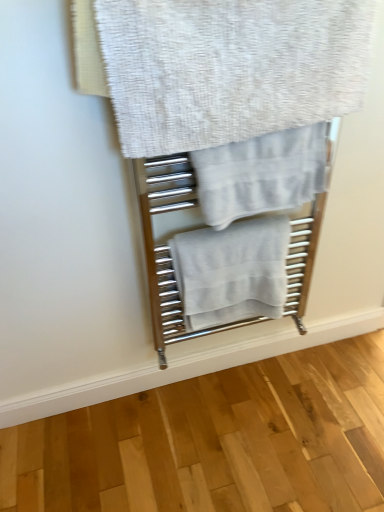
How much space does light gray cotton towel at center, which ranks as the second towel in top-to-bottom order, occupy horizontally?

The width of light gray cotton towel at center, which ranks as the second towel in top-to-bottom order, is 5.88 inches.

Image resolution: width=384 pixels, height=512 pixels. What are the coordinates of `white textured towel at upper center, marked as the third towel in a bottom-to-top arrangement` in the screenshot? It's located at (230, 68).

Is white cotton towel at center, the 3th towel in the top-to-bottom sequence, not inside white textured towel at upper center, acting as the first towel starting from the top?

Yes, white cotton towel at center, the 3th towel in the top-to-bottom sequence, is not within white textured towel at upper center, acting as the first towel starting from the top.

Is point (198, 245) positioned in front of point (298, 13)?

No, it is behind (298, 13).

Can you confirm if white cotton towel at center, the 3th towel in the top-to-bottom sequence, is bigger than white textured towel at upper center, marked as the third towel in a bottom-to-top arrangement?

No, white cotton towel at center, the 3th towel in the top-to-bottom sequence, is not bigger than white textured towel at upper center, marked as the third towel in a bottom-to-top arrangement.

Is white cotton towel at center, the 3th towel in the top-to-bottom sequence, in front of white textured towel at upper center, marked as the third towel in a bottom-to-top arrangement?

No, it is behind white textured towel at upper center, marked as the third towel in a bottom-to-top arrangement.

Can you tell me how much white cotton towel at center, which is the 1th towel in bottom-to-top order, and light gray cotton towel at center, which ranks as the second towel in top-to-bottom order, differ in facing direction?

0.000276 degrees separate the facing orientations of white cotton towel at center, which is the 1th towel in bottom-to-top order, and light gray cotton towel at center, which ranks as the second towel in top-to-bottom order.

Visually, is white cotton towel at center, the 3th towel in the top-to-bottom sequence, positioned to the left or to the right of light gray cotton towel at center, which ranks as the second towel in top-to-bottom order?

Clearly, white cotton towel at center, the 3th towel in the top-to-bottom sequence, is on the left of light gray cotton towel at center, which ranks as the second towel in top-to-bottom order, in the image.

Is white cotton towel at center, which is the 1th towel in bottom-to-top order, located outside light gray cotton towel at center, which is the second towel from bottom to top?

Yes, white cotton towel at center, which is the 1th towel in bottom-to-top order, is outside of light gray cotton towel at center, which is the second towel from bottom to top.

Considering the positions of points (188, 289) and (201, 196), is point (188, 289) farther from camera compared to point (201, 196)?

Yes.

Is white textured towel at upper center, marked as the third towel in a bottom-to-top arrangement, oriented away from white cotton towel at center, which is the 1th towel in bottom-to-top order?

That's not correct — white textured towel at upper center, marked as the third towel in a bottom-to-top arrangement, is not looking away from white cotton towel at center, which is the 1th towel in bottom-to-top order.

Is the surface of white textured towel at upper center, acting as the first towel starting from the top, in direct contact with white cotton towel at center, which is the 1th towel in bottom-to-top order?

white textured towel at upper center, acting as the first towel starting from the top, and white cotton towel at center, which is the 1th towel in bottom-to-top order, are clearly separated.

Considering the sizes of white textured towel at upper center, marked as the third towel in a bottom-to-top arrangement, and white cotton towel at center, which is the 1th towel in bottom-to-top order, in the image, is white textured towel at upper center, marked as the third towel in a bottom-to-top arrangement, wider or thinner than white cotton towel at center, which is the 1th towel in bottom-to-top order,?

white textured towel at upper center, marked as the third towel in a bottom-to-top arrangement, is thinner than white cotton towel at center, which is the 1th towel in bottom-to-top order.

Would you say white textured towel at upper center, acting as the first towel starting from the top, is inside or outside white cotton towel at center, the 3th towel in the top-to-bottom sequence?

white textured towel at upper center, acting as the first towel starting from the top, is not enclosed by white cotton towel at center, the 3th towel in the top-to-bottom sequence.

From a real-world perspective, starting from the white cotton towel at center, the 3th towel in the top-to-bottom sequence, which towel is the 1st one vertically above it? Please provide its 2D coordinates.

[(261, 174)]

Could you measure the distance between light gray cotton towel at center, which ranks as the second towel in top-to-bottom order, and white cotton towel at center, the 3th towel in the top-to-bottom sequence?

Result: light gray cotton towel at center, which ranks as the second towel in top-to-bottom order, is 8.45 inches from white cotton towel at center, the 3th towel in the top-to-bottom sequence.

From the picture: From the image's perspective, is light gray cotton towel at center, which ranks as the second towel in top-to-bottom order, located above or below white cotton towel at center, which is the 1th towel in bottom-to-top order?

From the image's perspective, light gray cotton towel at center, which ranks as the second towel in top-to-bottom order, appears above white cotton towel at center, which is the 1th towel in bottom-to-top order.

Based on the photo, considering the relative sizes of light gray cotton towel at center, which ranks as the second towel in top-to-bottom order, and white cotton towel at center, the 3th towel in the top-to-bottom sequence, in the image provided, is light gray cotton towel at center, which ranks as the second towel in top-to-bottom order, smaller than white cotton towel at center, the 3th towel in the top-to-bottom sequence,?

Yes.

From a real-world perspective, is white textured towel at upper center, marked as the third towel in a bottom-to-top arrangement, over light gray cotton towel at center, which is the second towel from bottom to top?

Correct, in the physical world, white textured towel at upper center, marked as the third towel in a bottom-to-top arrangement, is higher than light gray cotton towel at center, which is the second towel from bottom to top.

Can you confirm if white textured towel at upper center, marked as the third towel in a bottom-to-top arrangement, is bigger than light gray cotton towel at center, which is the second towel from bottom to top?

Yes.

Which is less distant, (124,96) or (270,191)?

The point (124,96) is closer to the camera.

From the image's perspective, is white textured towel at upper center, marked as the third towel in a bottom-to-top arrangement, located beneath light gray cotton towel at center, which is the second towel from bottom to top?

No.

Locate an element on the screen. This screenshot has width=384, height=512. the 1st towel below the white textured towel at upper center, marked as the third towel in a bottom-to-top arrangement (from the image's perspective) is located at coordinates (261, 174).

Is light gray cotton towel at center, which is the second towel from bottom to top, outside of white textured towel at upper center, marked as the third towel in a bottom-to-top arrangement?

light gray cotton towel at center, which is the second towel from bottom to top, lies outside white textured towel at upper center, marked as the third towel in a bottom-to-top arrangement,'s area.

Which of these two, light gray cotton towel at center, which is the second towel from bottom to top, or white textured towel at upper center, marked as the third towel in a bottom-to-top arrangement, stands taller?

Standing taller between the two is white textured towel at upper center, marked as the third towel in a bottom-to-top arrangement.

From the image's perspective, is light gray cotton towel at center, which is the second towel from bottom to top, beneath white textured towel at upper center, marked as the third towel in a bottom-to-top arrangement?

Yes.

Image resolution: width=384 pixels, height=512 pixels. I want to click on towel on the left side of white cotton towel at center, the 3th towel in the top-to-bottom sequence, so click(x=230, y=68).

In the image, there is a light gray cotton towel at center, which is the second towel from bottom to top. Where is `towel below it (from a real-world perspective)`? The width and height of the screenshot is (384, 512). towel below it (from a real-world perspective) is located at coordinates (232, 271).

From the image, which object appears to be farther from white textured towel at upper center, marked as the third towel in a bottom-to-top arrangement, white cotton towel at center, the 3th towel in the top-to-bottom sequence, or light gray cotton towel at center, which ranks as the second towel in top-to-bottom order?

Based on the image, white cotton towel at center, the 3th towel in the top-to-bottom sequence, appears to be further to white textured towel at upper center, marked as the third towel in a bottom-to-top arrangement.

Based on their spatial positions, is white textured towel at upper center, acting as the first towel starting from the top, or white cotton towel at center, the 3th towel in the top-to-bottom sequence, closer to light gray cotton towel at center, which is the second towel from bottom to top?

white textured towel at upper center, acting as the first towel starting from the top, is positioned closer to the anchor light gray cotton towel at center, which is the second towel from bottom to top.

Which object lies further to the anchor point white cotton towel at center, the 3th towel in the top-to-bottom sequence, white textured towel at upper center, marked as the third towel in a bottom-to-top arrangement, or light gray cotton towel at center, which ranks as the second towel in top-to-bottom order?

The object further to white cotton towel at center, the 3th towel in the top-to-bottom sequence, is white textured towel at upper center, marked as the third towel in a bottom-to-top arrangement.

Consider the image. When comparing their distances from light gray cotton towel at center, which ranks as the second towel in top-to-bottom order, does white cotton towel at center, the 3th towel in the top-to-bottom sequence, or white textured towel at upper center, acting as the first towel starting from the top, seem further?

white cotton towel at center, the 3th towel in the top-to-bottom sequence, is positioned further to the anchor light gray cotton towel at center, which ranks as the second towel in top-to-bottom order.

Based on their spatial positions, is light gray cotton towel at center, which ranks as the second towel in top-to-bottom order, or white textured towel at upper center, acting as the first towel starting from the top, further from white cotton towel at center, which is the 1th towel in bottom-to-top order?

white textured towel at upper center, acting as the first towel starting from the top, is further to white cotton towel at center, which is the 1th towel in bottom-to-top order.

Considering their positions, is light gray cotton towel at center, which ranks as the second towel in top-to-bottom order, positioned closer to white textured towel at upper center, acting as the first towel starting from the top, than white cotton towel at center, which is the 1th towel in bottom-to-top order?

Based on the image, light gray cotton towel at center, which ranks as the second towel in top-to-bottom order, appears to be nearer to white textured towel at upper center, acting as the first towel starting from the top.

Locate an element on the screen. This screenshot has width=384, height=512. towel between white textured towel at upper center, marked as the third towel in a bottom-to-top arrangement, and white cotton towel at center, which is the 1th towel in bottom-to-top order, in the vertical direction is located at coordinates (261, 174).